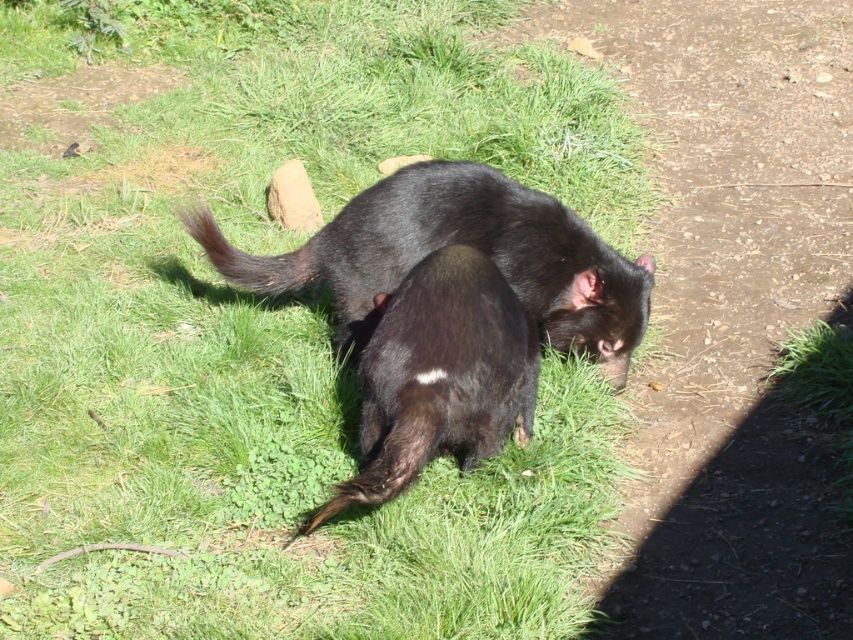
Locate an element on the screen. The width and height of the screenshot is (853, 640). shiny black tasmanian devil at center is located at coordinates point(463,243).

Between point (537, 301) and point (451, 376), which one is positioned behind?

The point (537, 301) is more distant.

At what (x,y) coordinates should I click in order to perform the action: click on shiny black tasmanian devil at center. Please return your answer as a coordinate pair (x, y). The height and width of the screenshot is (640, 853). Looking at the image, I should click on (463, 243).

Is shiny black tasmanian devil at center below black furry tail at lower center?

No, shiny black tasmanian devil at center is not below black furry tail at lower center.

Is shiny black tasmanian devil at center smaller than black furry tail at lower center?

No, shiny black tasmanian devil at center is not smaller than black furry tail at lower center.

Locate an element on the screen. shiny black tasmanian devil at center is located at coordinates (463, 243).

Is black furry tail at lower center thinner than dark brown fur tail at upper center?

Indeed, black furry tail at lower center has a lesser width compared to dark brown fur tail at upper center.

What do you see at coordinates (392, 449) in the screenshot?
I see `black furry tail at lower center` at bounding box center [392, 449].

Find the location of a particular element. The height and width of the screenshot is (640, 853). black furry tail at lower center is located at coordinates pos(392,449).

Image resolution: width=853 pixels, height=640 pixels. I want to click on black furry tail at lower center, so 392,449.